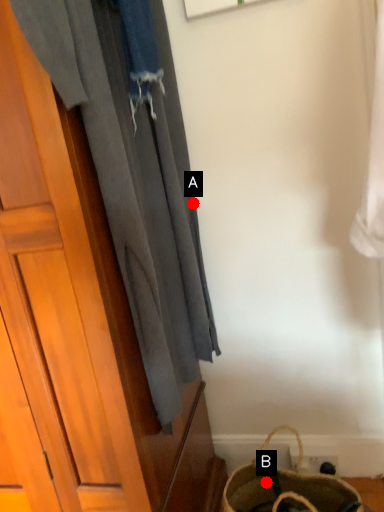
Question: Two points are circled on the image, labeled by A and B beside each circle. Among these points, which one is farthest from the camera?

Choices:
 (A) A is further
 (B) B is further

Answer: (B)